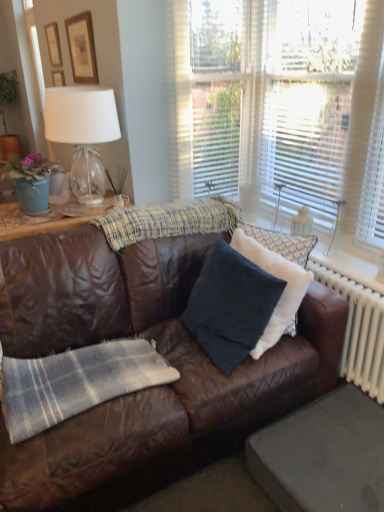
Question: Which direction should I rotate to face dark blue fabric pillow at center, which is the 2th pillow from right to left, — up or down?

Choices:
 (A) up
 (B) down

Answer: (B)

Question: Is wooden picture frame at upper left, which appears as the 1th picture frame when viewed from the right, smaller than gray fabric footrest at lower right?

Choices:
 (A) no
 (B) yes

Answer: (B)

Question: From the image's perspective, is wooden picture frame at upper left, which appears as the 1th picture frame when viewed from the right, above gray fabric footrest at lower right?

Choices:
 (A) yes
 (B) no

Answer: (A)

Question: From a real-world perspective, is wooden picture frame at upper left, the 2th picture frame in the left-to-right sequence, positioned under gray fabric footrest at lower right based on gravity?

Choices:
 (A) yes
 (B) no

Answer: (B)

Question: Can you confirm if wooden picture frame at upper left, positioned as the second picture frame in back-to-front order, is wider than gray fabric footrest at lower right?

Choices:
 (A) no
 (B) yes

Answer: (A)

Question: Is wooden picture frame at upper left, which appears as the first picture frame when viewed from the front, positioned with its back to gray fabric footrest at lower right?

Choices:
 (A) yes
 (B) no

Answer: (B)

Question: Does gray fabric footrest at lower right have a lesser width compared to dark blue fabric pillow at center, which is the 2th pillow from right to left?

Choices:
 (A) yes
 (B) no

Answer: (B)

Question: Is gray fabric footrest at lower right positioned before dark blue fabric pillow at center, which is the 1th pillow in left-to-right order?

Choices:
 (A) no
 (B) yes

Answer: (B)

Question: Is gray fabric footrest at lower right at the left side of dark blue fabric pillow at center, which is the 1th pillow in left-to-right order?

Choices:
 (A) no
 (B) yes

Answer: (A)

Question: Is dark blue fabric pillow at center, which is the 2th pillow from right to left, located within gray fabric footrest at lower right?

Choices:
 (A) yes
 (B) no

Answer: (B)

Question: From a real-world perspective, is gray fabric footrest at lower right under dark blue fabric pillow at center, which is the 2th pillow from right to left?

Choices:
 (A) no
 (B) yes

Answer: (B)

Question: Can you confirm if gray fabric footrest at lower right is wider than dark blue fabric pillow at center, which is the 1th pillow in left-to-right order?

Choices:
 (A) no
 (B) yes

Answer: (B)

Question: Is wooden picture frame at upper left, the 1th picture frame viewed from the back, at the back of dark blue fabric pillow at center, which is the 2th pillow from right to left?

Choices:
 (A) no
 (B) yes

Answer: (A)